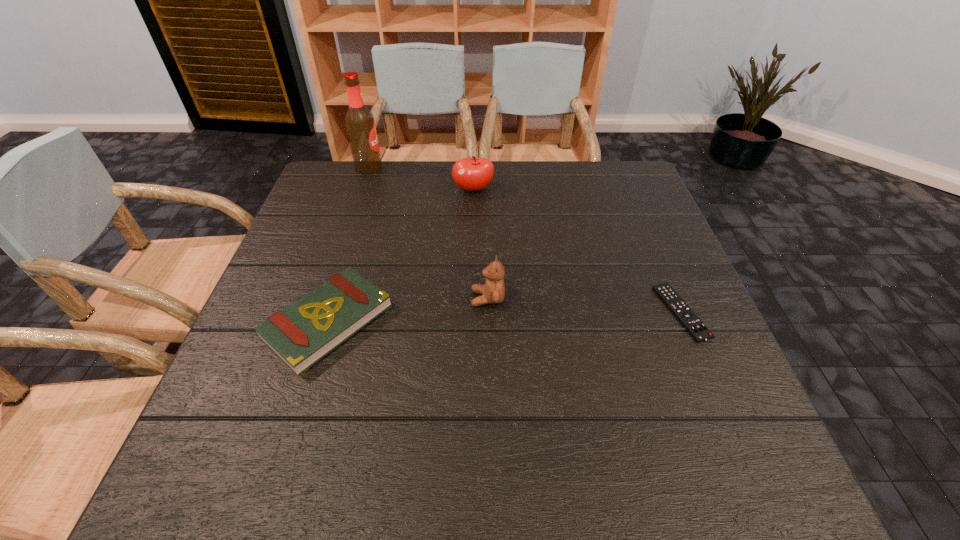
At what (x,y) coordinates should I click in order to perform the action: click on free space between the rightmost object and the tallest object. Please return your answer as a coordinate pair (x, y). The width and height of the screenshot is (960, 540). Looking at the image, I should click on (525, 240).

Locate an element on the screen. The width and height of the screenshot is (960, 540). vacant area that lies between the rightmost object and the fourth nearest object is located at coordinates (577, 251).

Where is `free area in between the teddy bear and the apple`? free area in between the teddy bear and the apple is located at coordinates (480, 244).

Find the location of `free space between the book and the remote control`. free space between the book and the remote control is located at coordinates click(x=504, y=317).

This screenshot has height=540, width=960. I want to click on free area in between the teddy bear and the shortest object, so click(585, 305).

At what (x,y) coordinates should I click in order to perform the action: click on free space that is in between the teddy bear and the fourth nearest object. Please return your answer as a coordinate pair (x, y). The height and width of the screenshot is (540, 960). Looking at the image, I should click on (480, 244).

I want to click on object that stands as the second closest to the teddy bear, so click(474, 173).

You are a GUI agent. You are given a task and a screenshot of the screen. Output one action in this format:
    pyautogui.click(x=<x>, y=<y>)
    Task: Click on the closest object to the beer bottle
    The height and width of the screenshot is (540, 960).
    Given the screenshot: What is the action you would take?
    pyautogui.click(x=474, y=173)

The image size is (960, 540). What are the coordinates of `vacant area that satisfies the following two spatial constraints: 1. on the face of the rightmost object; 2. on the right side of the teddy bear` in the screenshot? It's located at (488, 312).

Find the location of a particular element. vacant space that satisfies the following two spatial constraints: 1. on the face of the teddy bear; 2. on the front side of the fourth tallest object is located at coordinates (488, 321).